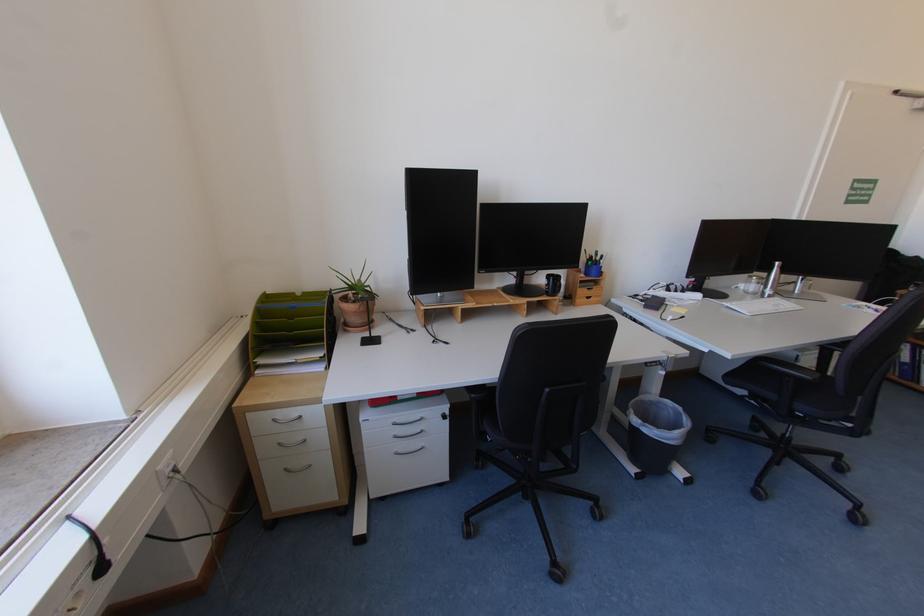
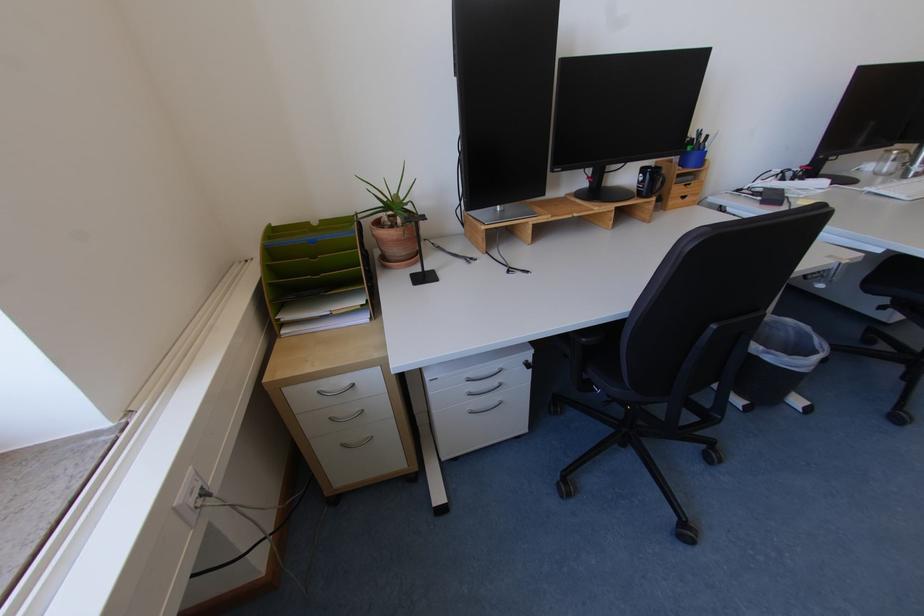
Based on the photo, what movement of the cameraman would produce the second image?

The movement direction of the cameraman is left, forward.